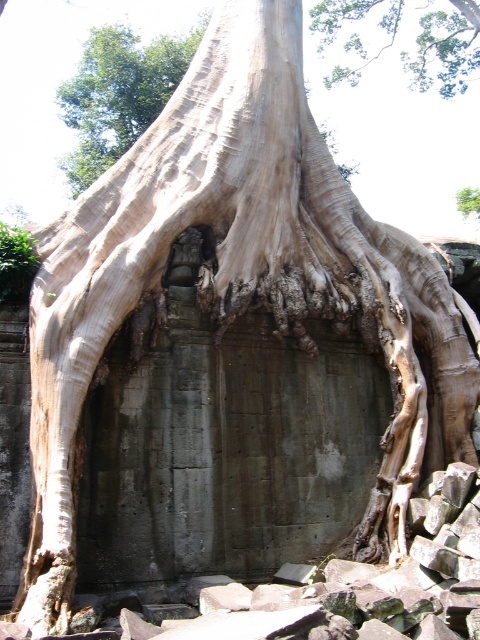
Locate an element on the screen. This screenshot has width=480, height=640. green leafy tree at upper left is located at coordinates (118, 93).

This screenshot has width=480, height=640. Describe the element at coordinates (118, 93) in the screenshot. I see `green leafy tree at upper left` at that location.

Locate an element on the screen. The image size is (480, 640). green leafy tree at upper left is located at coordinates (118, 93).